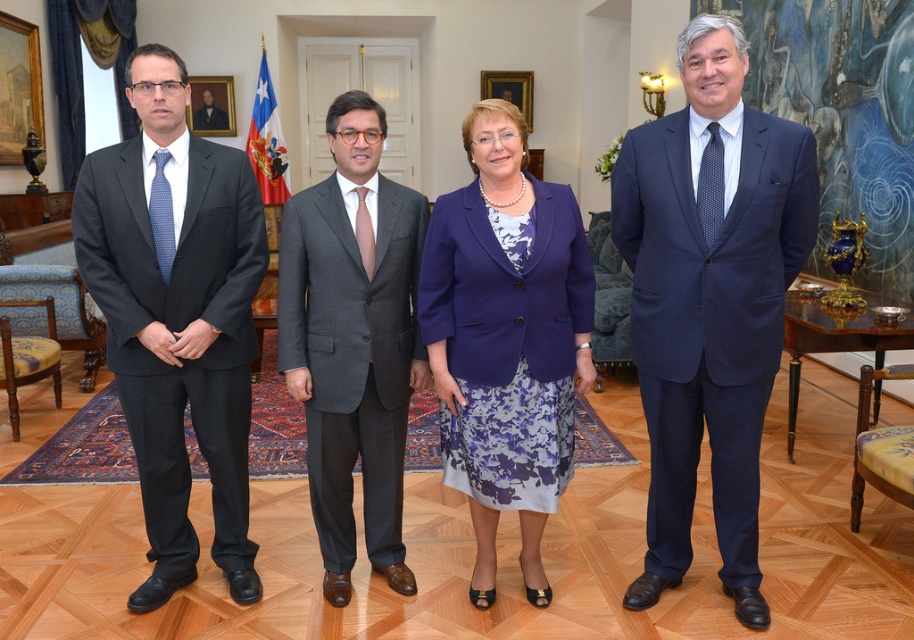
Question: Does navy blue suit at right appear on the right side of matte blue blazer at center?

Choices:
 (A) no
 (B) yes

Answer: (B)

Question: Does matte blue blazer at center appear under gray wool suit at center?

Choices:
 (A) no
 (B) yes

Answer: (B)

Question: Which point is farther to the camera?

Choices:
 (A) matte blue blazer at center
 (B) gray wool suit at center
 (C) matte black suit at left

Answer: (B)

Question: Among these points, which one is nearest to the camera?

Choices:
 (A) [x=146, y=120]
 (B) [x=330, y=268]
 (C) [x=480, y=433]
 (D) [x=760, y=243]

Answer: (D)

Question: Where is navy blue suit at right located in relation to matte blue blazer at center in the image?

Choices:
 (A) below
 (B) above

Answer: (B)

Question: Which point is farther to the camera?

Choices:
 (A) (326, 598)
 (B) (567, 227)

Answer: (A)